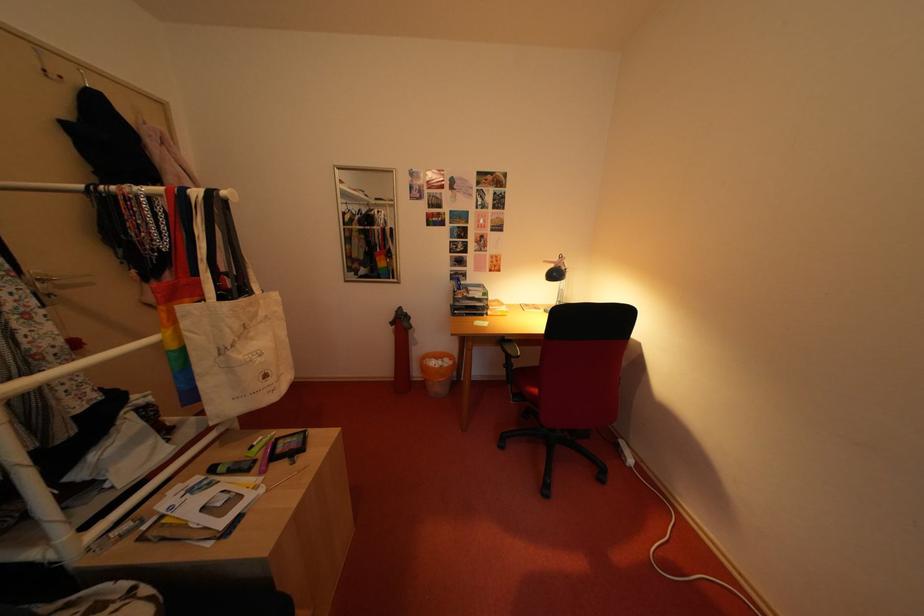
Find where to lift the white canvas tote bag. Please return your answer as a coordinate pair (x, y).

(232, 325)